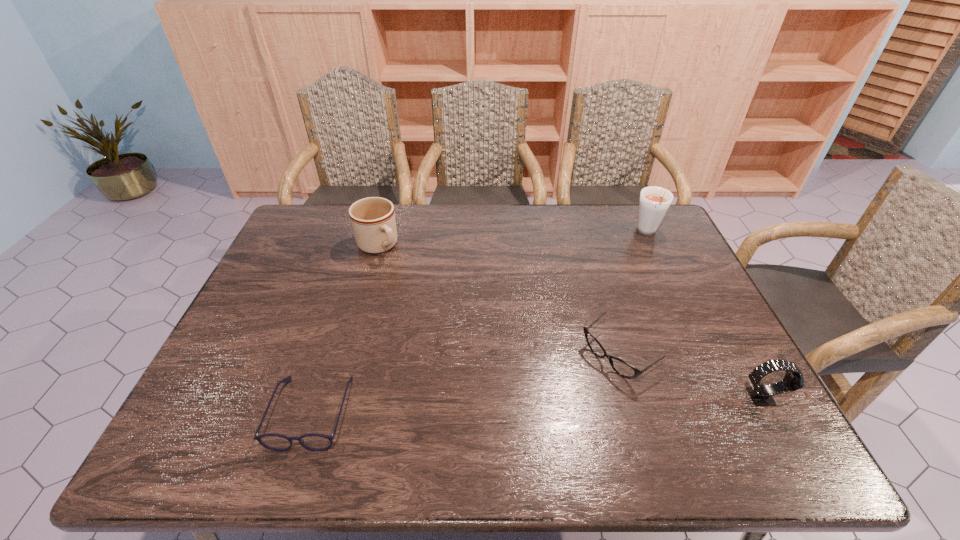
Where is `vacant area situated on the drink side of the root beer`? vacant area situated on the drink side of the root beer is located at coordinates (642, 252).

Image resolution: width=960 pixels, height=540 pixels. Find the location of `vacant space positioned 0.070m on the front-facing side of the third object from left to right`. vacant space positioned 0.070m on the front-facing side of the third object from left to right is located at coordinates (574, 390).

This screenshot has width=960, height=540. Find the location of `vacant space located on the front-facing side of the third object from left to right`. vacant space located on the front-facing side of the third object from left to right is located at coordinates (540, 417).

Locate an element on the screen. This screenshot has height=540, width=960. vacant space located 0.140m on the front-facing side of the third object from left to right is located at coordinates (553, 407).

Identify the location of mug present at the far edge. (373, 222).

Find the location of a particular element. Image resolution: width=960 pixels, height=540 pixels. root beer that is at the far edge is located at coordinates (654, 202).

Find the location of a particular element. This screenshot has width=960, height=540. watch that is at the near edge is located at coordinates (761, 395).

At what (x,y) coordinates should I click in order to perform the action: click on watch that is at the right edge. Please return your answer as a coordinate pair (x, y). Looking at the image, I should click on (761, 395).

You are a GUI agent. You are given a task and a screenshot of the screen. Output one action in this format:
    pyautogui.click(x=<x>, y=<y>)
    Task: Click on the root beer located in the right edge section of the desktop
    The height and width of the screenshot is (540, 960).
    Given the screenshot: What is the action you would take?
    pyautogui.click(x=654, y=202)

You are a GUI agent. You are given a task and a screenshot of the screen. Output one action in this format:
    pyautogui.click(x=<x>, y=<y>)
    Task: Click on the object that is at the far right corner
    The image size is (960, 540).
    Given the screenshot: What is the action you would take?
    pyautogui.click(x=654, y=202)